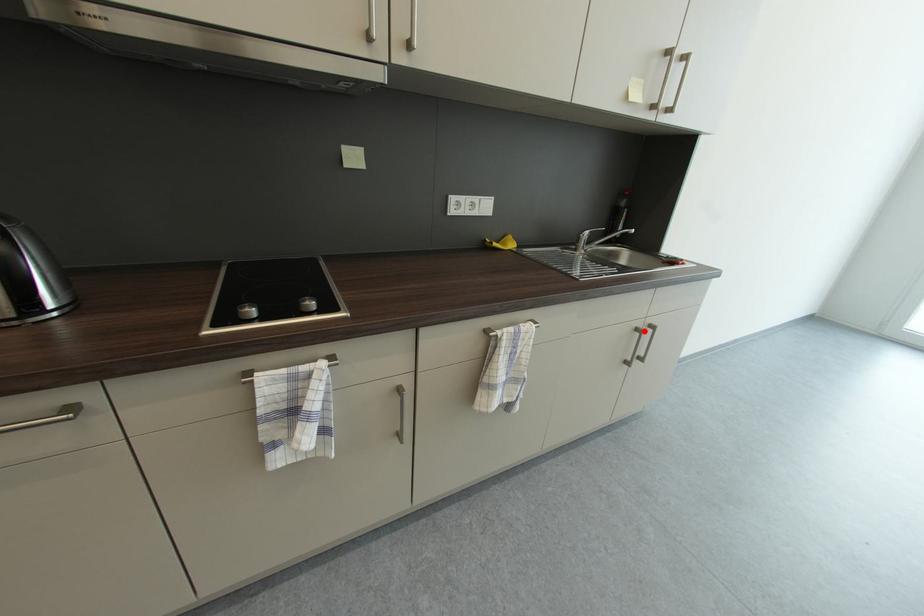
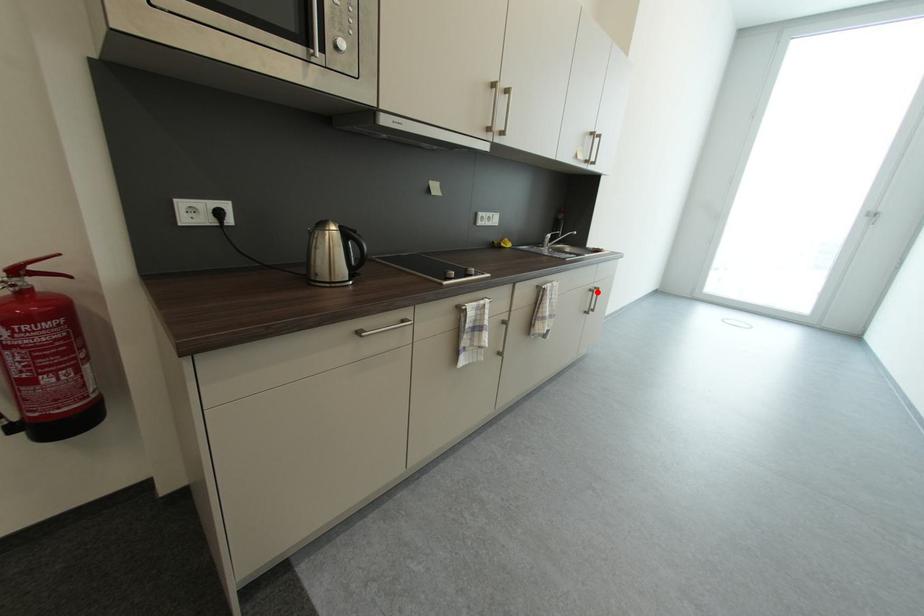
I am providing you with two images of the same scene from different viewpoints. A red point is marked on the first image and another point is marked on the second image. Do the highlighted points in image1 and image2 indicate the same real-world spot?

Yes